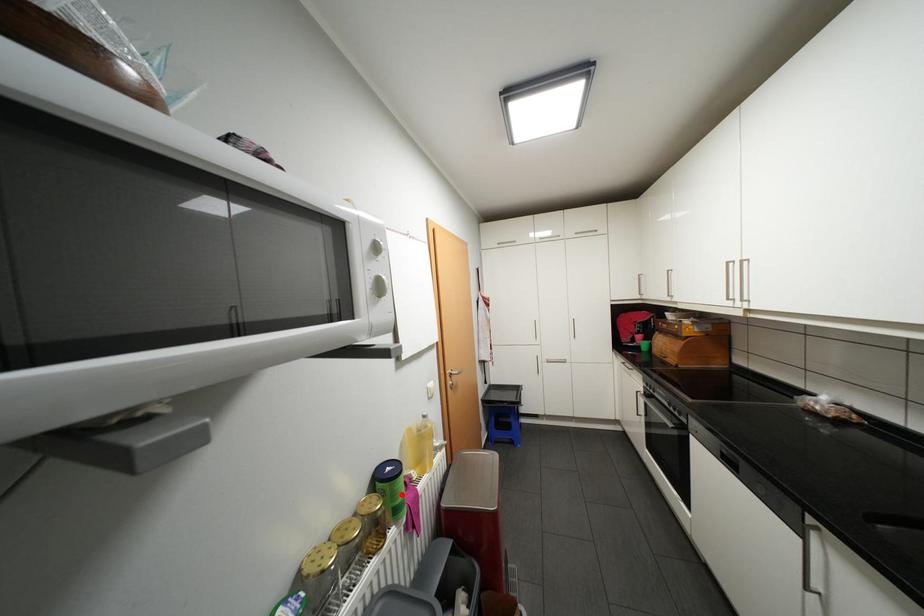
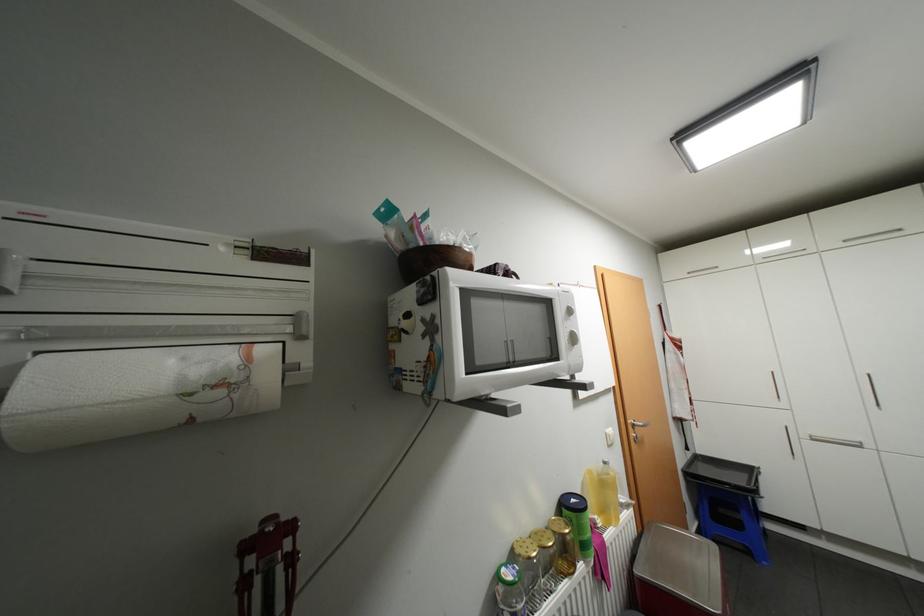
Locate, in the second image, the point that corresponds to the highlighted location in the first image.

(589, 528)